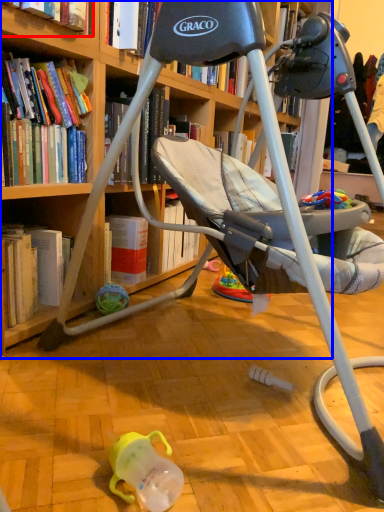
Question: Among these objects, which one is nearest to the camera, book (highlighted by a red box) or bookcase (highlighted by a blue box)?

Choices:
 (A) book
 (B) bookcase

Answer: (B)